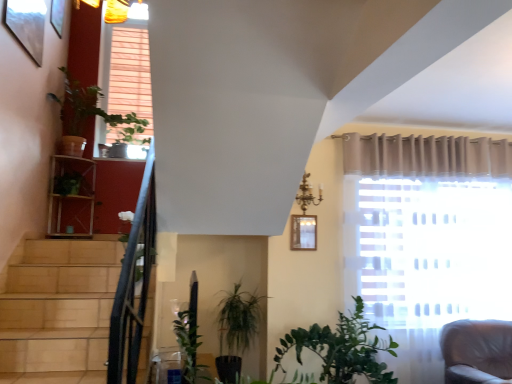
Question: From the image's perspective, is green leafy plant at upper left beneath wooden picture frame at upper center?

Choices:
 (A) yes
 (B) no

Answer: (B)

Question: From the image's perspective, is green leafy plant at upper left over wooden picture frame at upper center?

Choices:
 (A) yes
 (B) no

Answer: (A)

Question: Considering the relative positions of green leafy plant at upper left and wooden picture frame at upper center in the image provided, is green leafy plant at upper left to the right of wooden picture frame at upper center from the viewer's perspective?

Choices:
 (A) no
 (B) yes

Answer: (A)

Question: Is green leafy plant at upper left taller than wooden picture frame at upper center?

Choices:
 (A) yes
 (B) no

Answer: (A)

Question: Is the position of green leafy plant at upper left more distant than that of wooden picture frame at upper center?

Choices:
 (A) yes
 (B) no

Answer: (A)

Question: Considering the relative sizes of green leafy plant at upper left and wooden picture frame at upper center in the image provided, is green leafy plant at upper left thinner than wooden picture frame at upper center?

Choices:
 (A) no
 (B) yes

Answer: (A)

Question: From the image's perspective, would you say wooden picture frame at upper center is shown under green leafy plant at upper left?

Choices:
 (A) no
 (B) yes

Answer: (B)

Question: Considering the relative positions of wooden picture frame at upper center and green leafy plant at upper left in the image provided, is wooden picture frame at upper center to the left of green leafy plant at upper left from the viewer's perspective?

Choices:
 (A) no
 (B) yes

Answer: (A)

Question: Is wooden picture frame at upper center surrounding green leafy plant at upper left?

Choices:
 (A) yes
 (B) no

Answer: (B)

Question: From the image's perspective, is wooden picture frame at upper center above green leafy plant at upper left?

Choices:
 (A) no
 (B) yes

Answer: (A)

Question: Is wooden picture frame at upper center not within green leafy plant at upper left?

Choices:
 (A) yes
 (B) no

Answer: (A)

Question: Is wooden picture frame at upper center with green leafy plant at upper left?

Choices:
 (A) no
 (B) yes

Answer: (A)

Question: From a real-world perspective, is wooden picture frame at upper center above or below green leafy plant at upper left?

Choices:
 (A) below
 (B) above

Answer: (A)